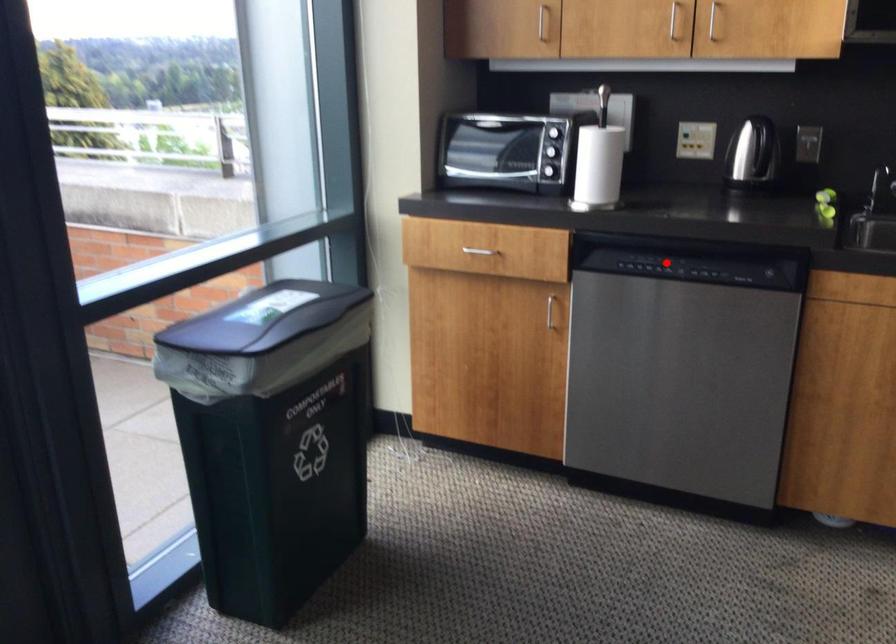
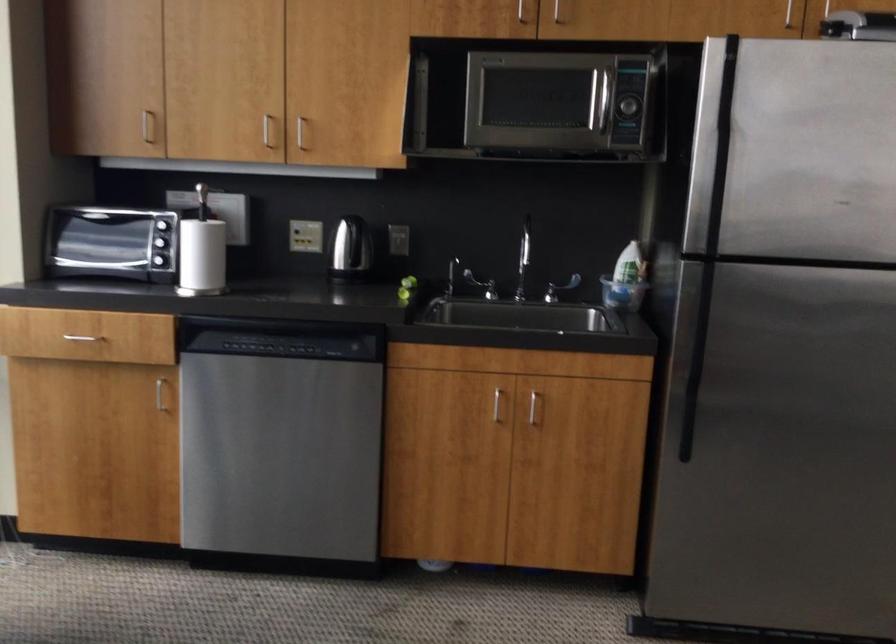
Question: I am providing you with two images of the same scene from different viewpoints. Image1 has a red point marked. In image2, the corresponding 3D location appears at what relative position? Reply with the corresponding letter.

Choices:
 (A) Closer
 (B) Farther

Answer: (B)